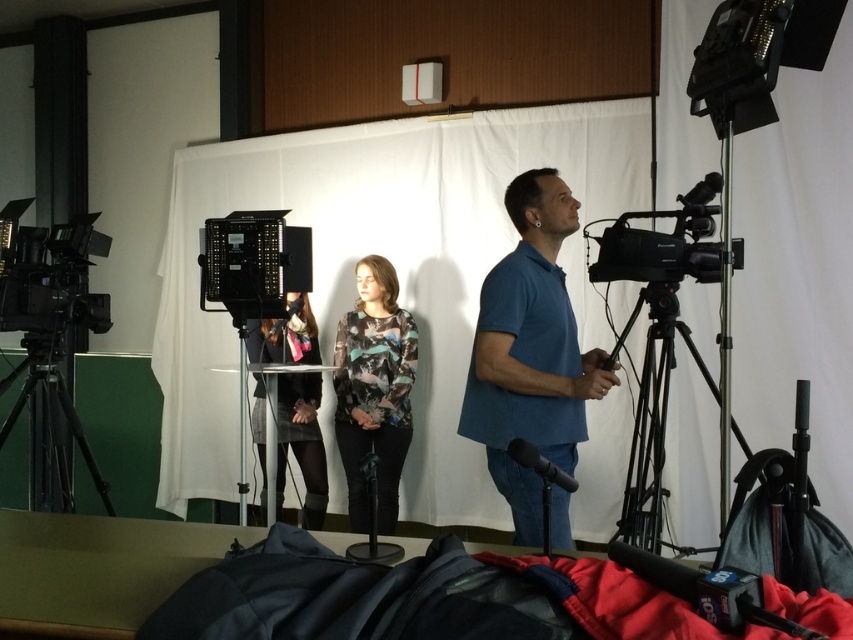
Question: Which point is farther to the camera?

Choices:
 (A) (51, 396)
 (B) (392, 378)
 (C) (505, 312)

Answer: (B)

Question: Which of these objects is positioned closest to the black matte tripod at left?

Choices:
 (A) dark gray fabric dress at center
 (B) blue cotton shirt at center
 (C) floral-patterned fabric at center

Answer: (A)

Question: Is blue cotton shirt at center bigger than dark gray fabric dress at center?

Choices:
 (A) yes
 (B) no

Answer: (B)

Question: Which of the following is the farthest from the observer?

Choices:
 (A) black metal tripod at right
 (B) floral-patterned fabric at center
 (C) blue cotton shirt at center
 (D) black matte tripod at left

Answer: (B)

Question: Can you confirm if blue cotton shirt at center is positioned above dark gray fabric dress at center?

Choices:
 (A) yes
 (B) no

Answer: (A)

Question: Can you confirm if blue cotton shirt at center is positioned below dark gray fabric dress at center?

Choices:
 (A) no
 (B) yes

Answer: (A)